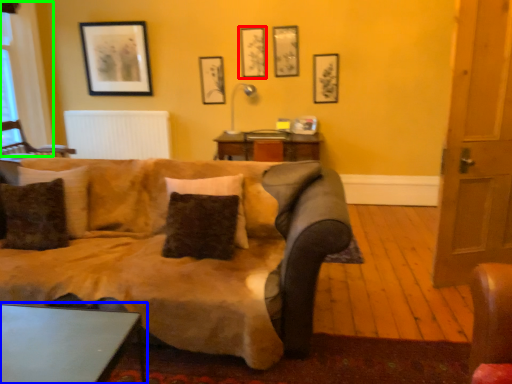
Question: Which object is positioned farthest from picture frame (highlighted by a red box)? Select from table (highlighted by a blue box) and bay window (highlighted by a green box).

Choices:
 (A) table
 (B) bay window

Answer: (A)